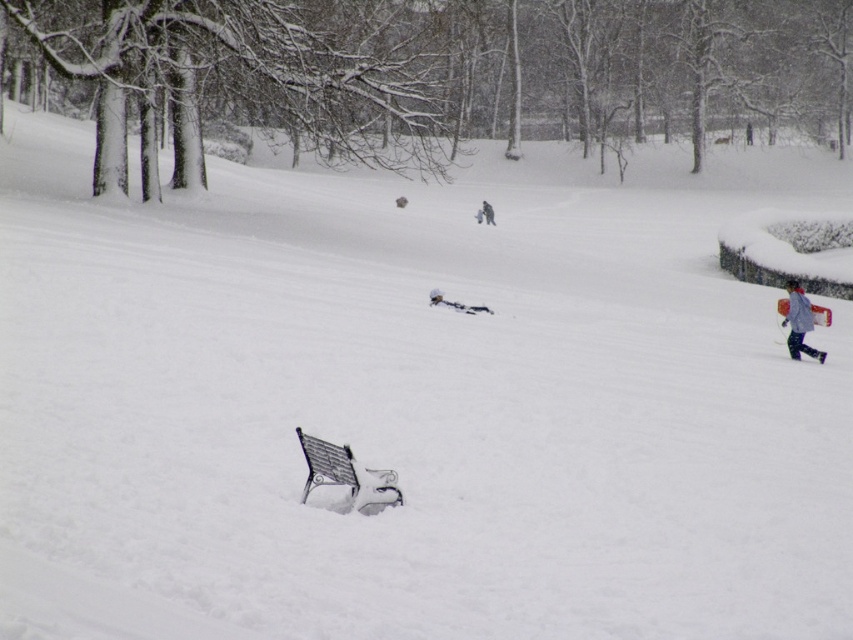
Question: Which object appears closest to the camera in this image?

Choices:
 (A) white snowboard at center
 (B) white matte ski at right

Answer: (B)

Question: Which point is farther from the camera taking this photo?

Choices:
 (A) (802, 333)
 (B) (483, 216)
 (C) (820, 356)

Answer: (B)

Question: Can you confirm if light blue fabric jacket at right is thinner than white matte ski at right?

Choices:
 (A) no
 (B) yes

Answer: (A)

Question: Does light blue fabric snowsuit at center appear on the left side of white snowboard at center?

Choices:
 (A) no
 (B) yes

Answer: (B)

Question: Is white matte ski at right positioned before white snowboard at center?

Choices:
 (A) no
 (B) yes

Answer: (B)

Question: Based on their relative distances, which object is nearer to the light blue fabric snowsuit at center?

Choices:
 (A) white snowboard at center
 (B) light blue fabric jacket at right

Answer: (B)